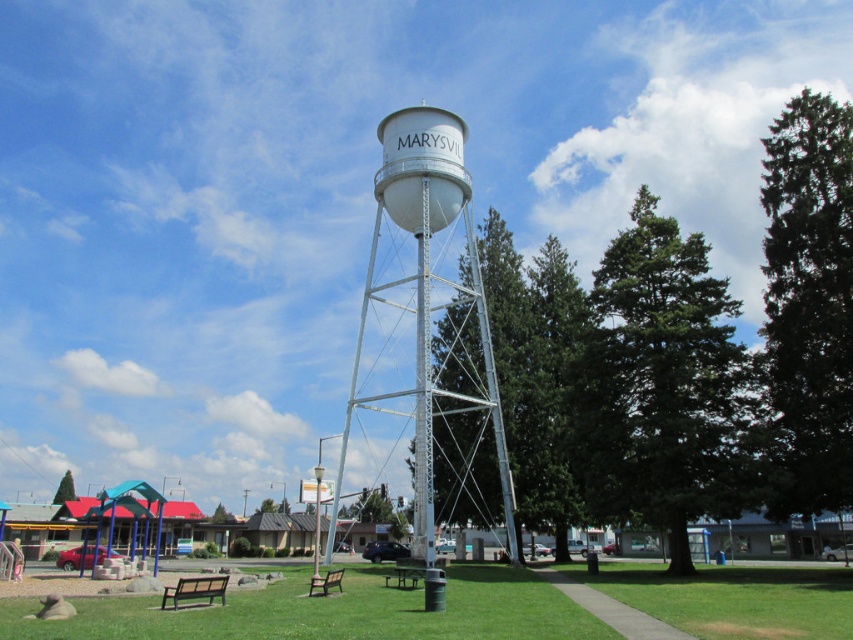
You are planning to set up a picnic and need to place your blanket. You see the white metallic water tower at center and the brown wooden picnic table at center. Which object should you place your blanket closer to if you want it to be on the left side of the picnic table?

You should place your blanket closer to the white metallic water tower at center because it is to the right of the brown wooden picnic table at center, so the picnic table itself is on the left side relative to the water tower. Therefore, placing the blanket near the picnic table would position it on the left side.

Consider the image. You are planning to take a photo of the white metallic water tower at center and the brown wooden picnic table at center from a distance. Which object will appear bigger in the photo?

The white metallic water tower at center will appear bigger in the photo because it is larger in size than the brown wooden picnic table at center.